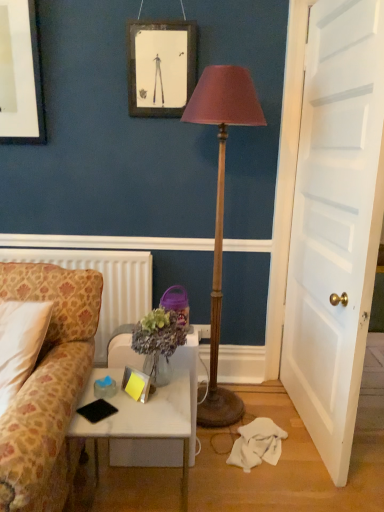
Where is `free point above white marble desk at lower left (from a real-world perspective)`? free point above white marble desk at lower left (from a real-world perspective) is located at coordinates (126, 402).